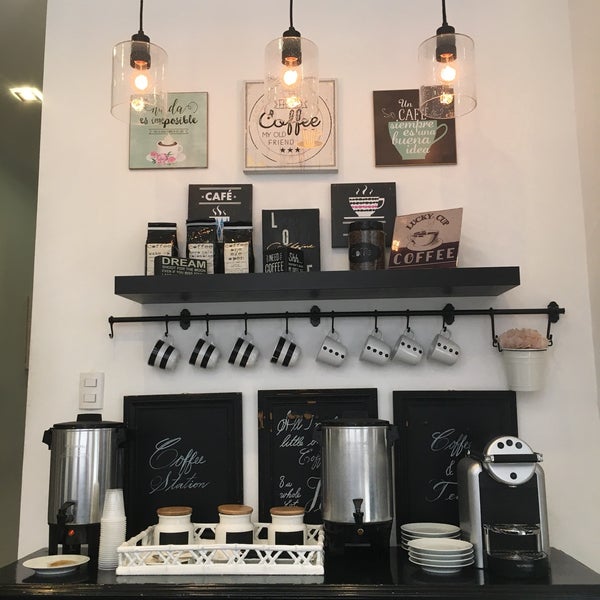
Locate an element on the screen. This screenshot has height=600, width=600. clear glass light covers is located at coordinates (112, 48), (265, 47), (418, 47).